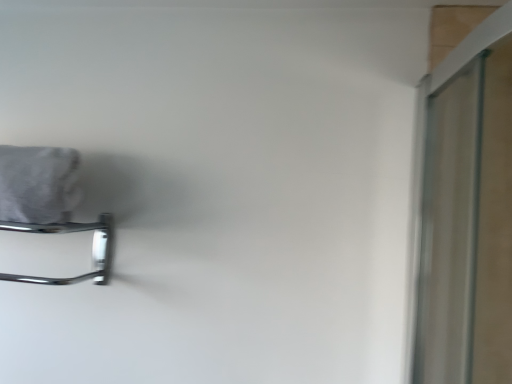
This screenshot has height=384, width=512. I want to click on chrome metallic towel rack at left, so click(71, 232).

Describe the element at coordinates (71, 232) in the screenshot. I see `chrome metallic towel rack at left` at that location.

The width and height of the screenshot is (512, 384). What do you see at coordinates (38, 184) in the screenshot?
I see `gray fabric bath towel at upper left` at bounding box center [38, 184].

Locate an element on the screen. gray fabric bath towel at upper left is located at coordinates (38, 184).

Find the location of `chrome metallic towel rack at left`. chrome metallic towel rack at left is located at coordinates point(71,232).

Is gray fabric bath towel at upper left to the right of chrome metallic towel rack at left from the viewer's perspective?

Incorrect, gray fabric bath towel at upper left is not on the right side of chrome metallic towel rack at left.

Considering their positions, is gray fabric bath towel at upper left located in front of or behind chrome metallic towel rack at left?

gray fabric bath towel at upper left is positioned closer to the viewer than chrome metallic towel rack at left.

Considering the points (9, 205) and (50, 279), which point is in front, point (9, 205) or point (50, 279)?

The point (9, 205) is more forward.

Looking at this image, from the image's perspective, which is below, gray fabric bath towel at upper left or chrome metallic towel rack at left?

chrome metallic towel rack at left, from the image's perspective.

From a real-world perspective, who is located lower, gray fabric bath towel at upper left or chrome metallic towel rack at left?

chrome metallic towel rack at left.

Which object is thinner, gray fabric bath towel at upper left or chrome metallic towel rack at left?

chrome metallic towel rack at left.

Can you confirm if gray fabric bath towel at upper left is shorter than chrome metallic towel rack at left?

No.

Which of these two, gray fabric bath towel at upper left or chrome metallic towel rack at left, is smaller?

chrome metallic towel rack at left.

In the scene shown: Is chrome metallic towel rack at left located within gray fabric bath towel at upper left?

No, gray fabric bath towel at upper left does not contain chrome metallic towel rack at left.

Is gray fabric bath towel at upper left next to chrome metallic towel rack at left and touching it?

No, gray fabric bath towel at upper left is not next to chrome metallic towel rack at left.

Is gray fabric bath towel at upper left oriented towards chrome metallic towel rack at left?

No, gray fabric bath towel at upper left is not turned towards chrome metallic towel rack at left.

How many degrees apart are the facing directions of gray fabric bath towel at upper left and chrome metallic towel rack at left?

0.00963 degrees.

I want to click on towel rack behind the gray fabric bath towel at upper left, so [71, 232].

Between chrome metallic towel rack at left and gray fabric bath towel at upper left, which one appears on the right side from the viewer's perspective?

From the viewer's perspective, chrome metallic towel rack at left appears more on the right side.

Considering their positions, is chrome metallic towel rack at left located in front of or behind gray fabric bath towel at upper left?

In the image, chrome metallic towel rack at left appears behind gray fabric bath towel at upper left.

Considering the positions of points (5, 276) and (14, 146), is point (5, 276) farther from camera compared to point (14, 146)?

Yes, point (5, 276) is behind point (14, 146).

From the image's perspective, is chrome metallic towel rack at left on top of gray fabric bath towel at upper left?

No.

From a real-world perspective, which object rests below the other?

chrome metallic towel rack at left.

Consider the image. Looking at their sizes, would you say chrome metallic towel rack at left is wider or thinner than gray fabric bath towel at upper left?

In the image, chrome metallic towel rack at left appears to be more narrow than gray fabric bath towel at upper left.

Is chrome metallic towel rack at left shorter than gray fabric bath towel at upper left?

Indeed, chrome metallic towel rack at left has a lesser height compared to gray fabric bath towel at upper left.

In terms of size, does chrome metallic towel rack at left appear bigger or smaller than gray fabric bath towel at upper left?

Considering their sizes, chrome metallic towel rack at left takes up less space than gray fabric bath towel at upper left.

Would you say gray fabric bath towel at upper left is part of chrome metallic towel rack at left's contents?

No, gray fabric bath towel at upper left is not a part of chrome metallic towel rack at left.

Is chrome metallic towel rack at left directly adjacent to gray fabric bath towel at upper left?

chrome metallic towel rack at left and gray fabric bath towel at upper left are clearly separated.

Does chrome metallic towel rack at left turn towards gray fabric bath towel at upper left?

No, chrome metallic towel rack at left does not turn towards gray fabric bath towel at upper left.

How many degrees apart are the facing directions of chrome metallic towel rack at left and gray fabric bath towel at upper left?

There is a 0.00963-degree angle between the facing directions of chrome metallic towel rack at left and gray fabric bath towel at upper left.

How distant is chrome metallic towel rack at left from gray fabric bath towel at upper left?

chrome metallic towel rack at left and gray fabric bath towel at upper left are 4.03 inches apart.

Locate an element on the screen. The height and width of the screenshot is (384, 512). towel rack behind the gray fabric bath towel at upper left is located at coordinates (71, 232).

Identify the location of towel rack below the gray fabric bath towel at upper left (from a real-world perspective). (71, 232).

Where is `bath towel on the left of chrome metallic towel rack at left`? The image size is (512, 384). bath towel on the left of chrome metallic towel rack at left is located at coordinates (38, 184).